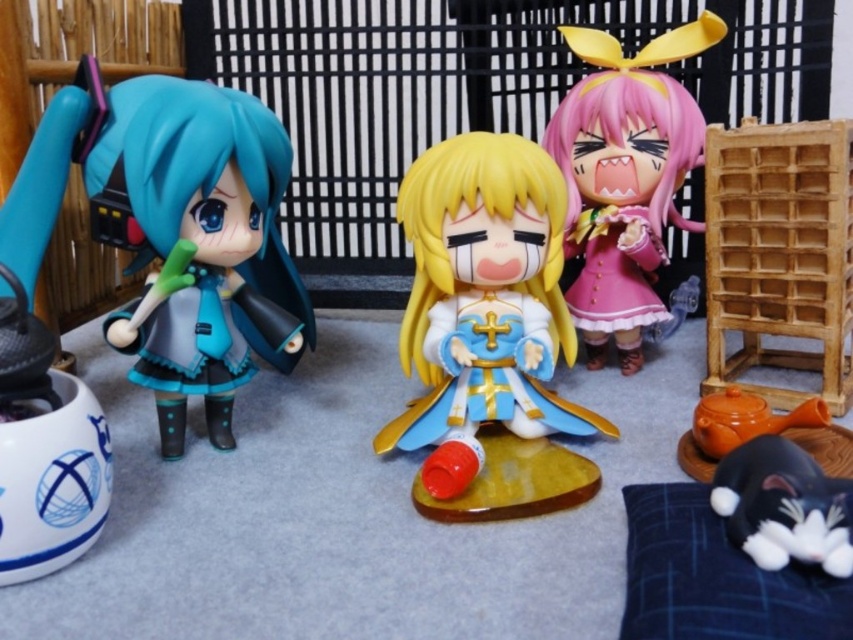
You are organizing a display of these anime figures. The shiny plastic figure at center and the matte black doll at left need to be placed on a shelf where height is a concern. Which of the two figures should be placed first to ensure they both fit without exceeding the shelf height limit?

The shiny plastic figure at center is not as tall as the matte black doll at left, so you should place the matte black doll at left first to ensure both fit within the shelf height limit.

Looking at the anime figurines displayed on the table, which one is positioned to the left between the shiny plastic figure at center and the pink matte plush at center?

The shiny plastic figure at center is positioned to the left of the pink matte plush at center.